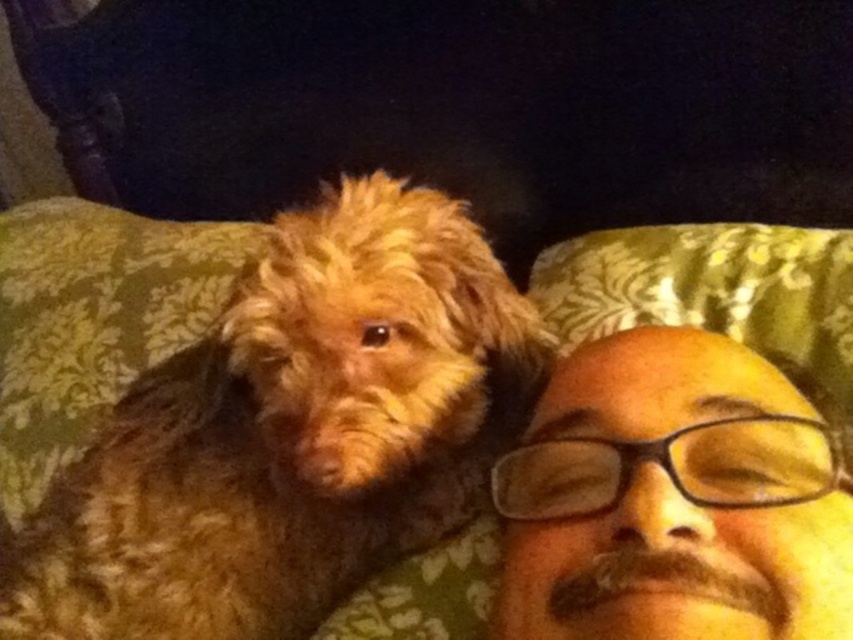
Question: Which point appears closest to the camera in this image?

Choices:
 (A) (608, 637)
 (B) (245, 616)

Answer: (A)

Question: Does fuzzy brown dog at upper left lie in front of brown matte face at upper right?

Choices:
 (A) yes
 (B) no

Answer: (B)

Question: Which of the following is the closest to the observer?

Choices:
 (A) (97, 627)
 (B) (836, 611)

Answer: (B)

Question: Does fuzzy brown dog at upper left appear over brown matte face at upper right?

Choices:
 (A) no
 (B) yes

Answer: (B)

Question: Does fuzzy brown dog at upper left appear over brown matte face at upper right?

Choices:
 (A) no
 (B) yes

Answer: (B)

Question: Which point is closer to the camera taking this photo?

Choices:
 (A) (527, 522)
 (B) (292, 628)

Answer: (A)